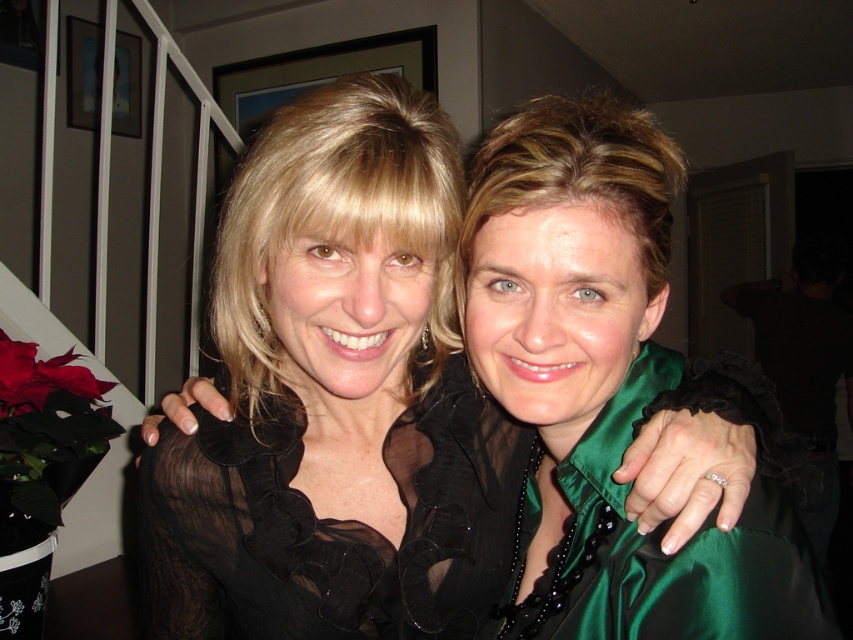
Question: In this image, where is black sheer blouse at center located relative to green satin dress at center?

Choices:
 (A) right
 (B) left

Answer: (B)

Question: Which of the following is the closest to the observer?

Choices:
 (A) black sheer blouse at center
 (B) green satin dress at center

Answer: (A)

Question: Is black sheer blouse at center bigger than green satin dress at center?

Choices:
 (A) yes
 (B) no

Answer: (A)

Question: Does black sheer blouse at center appear on the right side of black sheer dress at center?

Choices:
 (A) yes
 (B) no

Answer: (A)

Question: Among these points, which one is farthest from the camera?

Choices:
 (A) (242, 220)
 (B) (706, 394)
 (C) (200, 490)

Answer: (C)

Question: Among these objects, which one is nearest to the camera?

Choices:
 (A) green satin dress at center
 (B) black sheer dress at center
 (C) black sheer blouse at center

Answer: (C)